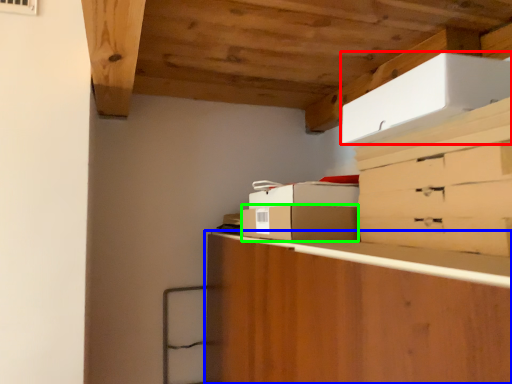
Question: Which object is positioned farthest from cardboard box (highlighted by a red box)? Select from cabinetry (highlighted by a blue box) and cardboard box (highlighted by a green box).

Choices:
 (A) cabinetry
 (B) cardboard box

Answer: (A)